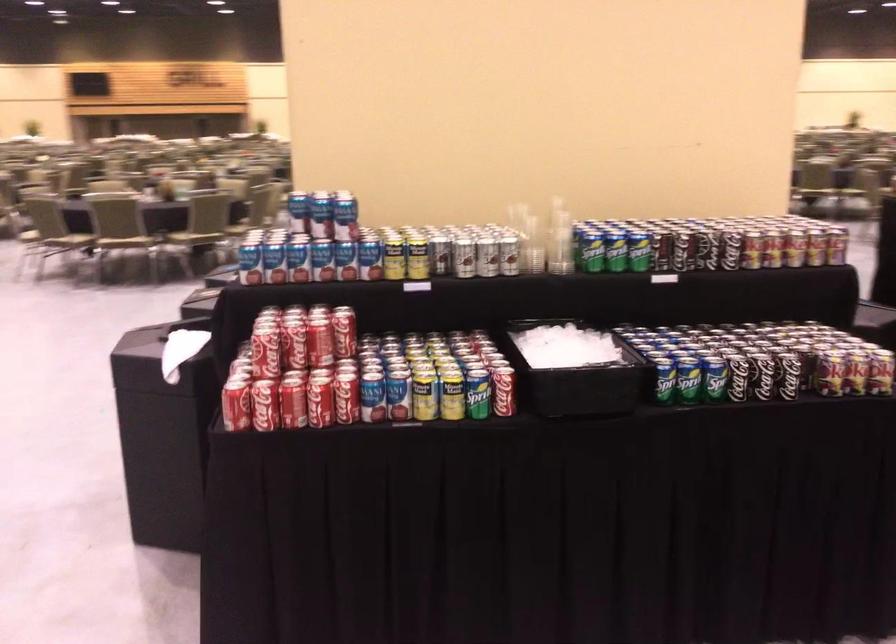
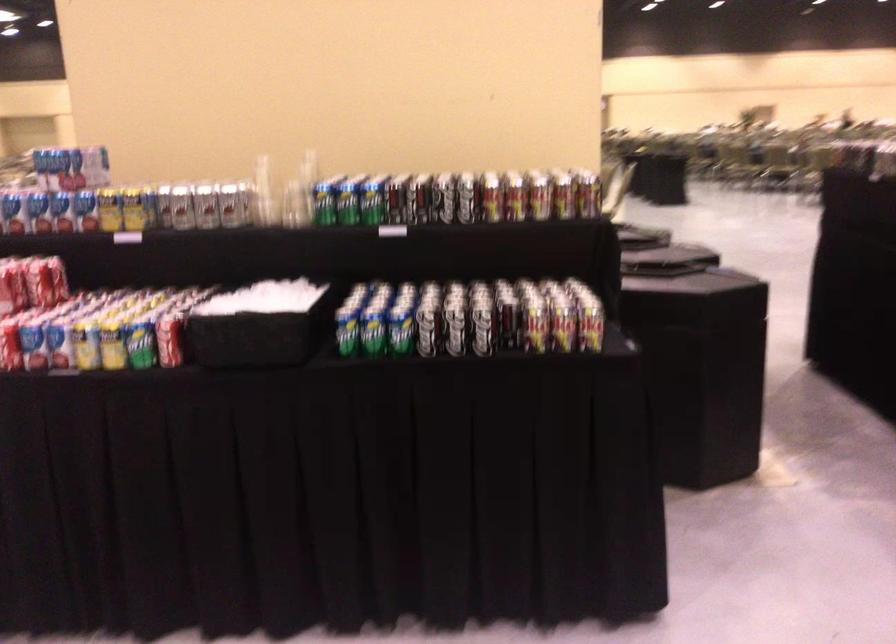
In the second image, find the point that corresponds to point (368, 261) in the first image.

(85, 210)